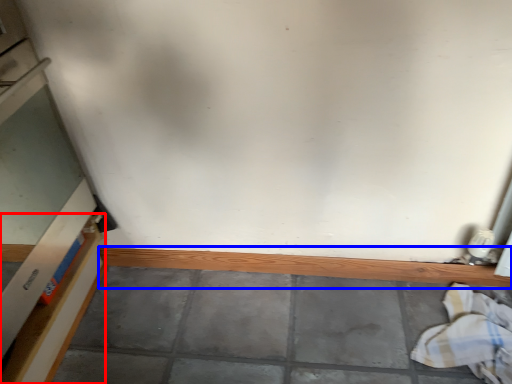
Question: Which point is closer to the camera, shelf (highlighted by a red box) or ledge (highlighted by a blue box)?

Choices:
 (A) shelf
 (B) ledge

Answer: (A)